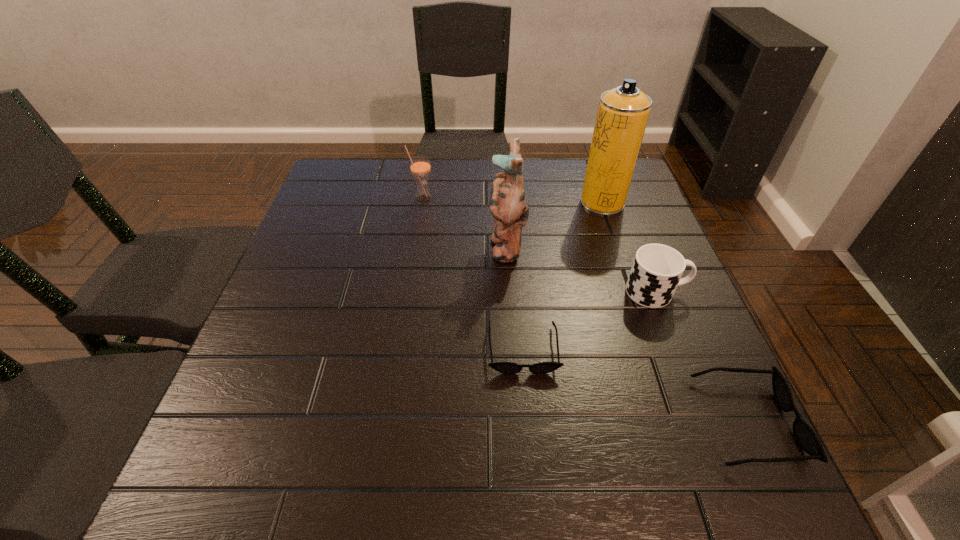
Find the location of a particular element. The width and height of the screenshot is (960, 540). the fifth farthest object is located at coordinates (503, 367).

What are the coordinates of `the left sunglasses` in the screenshot? It's located at (503, 367).

Where is `the nearest object`? the nearest object is located at coordinates (806, 437).

Where is `the second shortest object`? The height and width of the screenshot is (540, 960). the second shortest object is located at coordinates (806, 437).

Where is `the leftmost object`? the leftmost object is located at coordinates (420, 166).

Locate an element on the screen. straw is located at coordinates (420, 166).

Locate an element on the screen. the tallest object is located at coordinates (622, 115).

Find the location of a particular element. the third farthest object is located at coordinates (507, 204).

This screenshot has height=540, width=960. What are the coordinates of `figurine` in the screenshot? It's located at (507, 204).

Locate an element on the screen. Image resolution: width=960 pixels, height=540 pixels. cup is located at coordinates (657, 269).